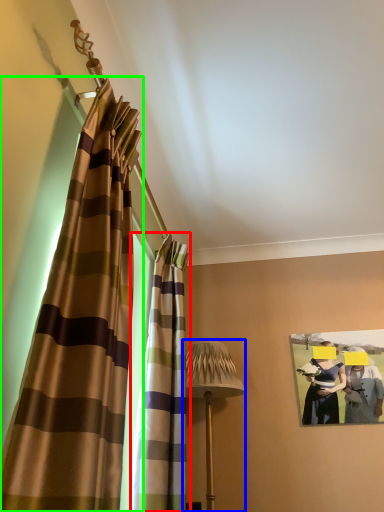
Question: Estimate the real-world distances between objects in this image. Which object is farther from curtain (highlighted by a red box), table lamp (highlighted by a blue box) or curtain (highlighted by a green box)?

Choices:
 (A) table lamp
 (B) curtain

Answer: (B)